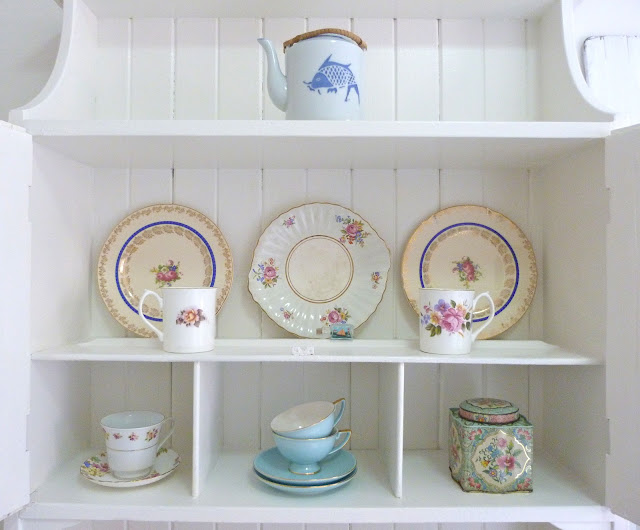
This screenshot has height=530, width=640. I want to click on cups, so [134, 460], [300, 449], [301, 421], [179, 316], [438, 316].